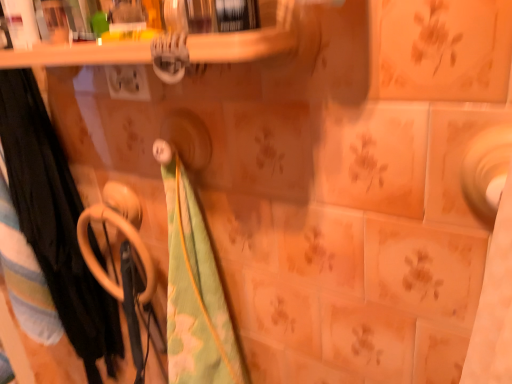
Question: Can you confirm if beige plastic towel rack at lower left is positioned to the right of matte ceramic tile at right?

Choices:
 (A) yes
 (B) no

Answer: (B)

Question: Does beige plastic towel rack at lower left have a greater width compared to matte ceramic tile at right?

Choices:
 (A) no
 (B) yes

Answer: (B)

Question: Does beige plastic towel rack at lower left have a lesser width compared to matte ceramic tile at right?

Choices:
 (A) yes
 (B) no

Answer: (B)

Question: Is beige plastic towel rack at lower left smaller than matte ceramic tile at right?

Choices:
 (A) yes
 (B) no

Answer: (B)

Question: Are beige plastic towel rack at lower left and matte ceramic tile at right beside each other?

Choices:
 (A) no
 (B) yes

Answer: (A)

Question: From a real-world perspective, is green cotton beach towel at left, which is counted as the second beach towel, starting from the left, positioned above or below beige plastic towel rack at lower left?

Choices:
 (A) below
 (B) above

Answer: (A)

Question: Is green cotton beach towel at left, which is counted as the second beach towel, starting from the left, taller or shorter than beige plastic towel rack at lower left?

Choices:
 (A) short
 (B) tall

Answer: (B)

Question: Considering the relative positions of green cotton beach towel at left, which is the 2th beach towel in right-to-left order, and beige plastic towel rack at lower left in the image provided, is green cotton beach towel at left, which is the 2th beach towel in right-to-left order, to the left or to the right of beige plastic towel rack at lower left?

Choices:
 (A) right
 (B) left

Answer: (B)

Question: Considering the positions of green cotton beach towel at left, which is counted as the second beach towel, starting from the left, and beige plastic towel rack at lower left in the image, is green cotton beach towel at left, which is counted as the second beach towel, starting from the left, wider or thinner than beige plastic towel rack at lower left?

Choices:
 (A) wide
 (B) thin

Answer: (A)

Question: Is green floral fabric at center, arranged as the third beach towel when viewed from the left, wider or thinner than black fabric towel at left, the first beach towel from the left?

Choices:
 (A) wide
 (B) thin

Answer: (B)

Question: Choose the correct answer: Is green floral fabric at center, arranged as the third beach towel when viewed from the left, inside black fabric towel at left, which is the 3th beach towel from right to left, or outside it?

Choices:
 (A) inside
 (B) outside

Answer: (B)

Question: From their relative heights in the image, would you say green floral fabric at center, which is the 1th beach towel from right to left, is taller or shorter than black fabric towel at left, the first beach towel from the left?

Choices:
 (A) tall
 (B) short

Answer: (B)

Question: Visually, is green floral fabric at center, arranged as the third beach towel when viewed from the left, positioned to the left or to the right of black fabric towel at left, the first beach towel from the left?

Choices:
 (A) right
 (B) left

Answer: (A)

Question: Is black fabric towel at left, which is the 3th beach towel from right to left, to the left or to the right of green floral fabric at center, arranged as the third beach towel when viewed from the left, in the image?

Choices:
 (A) right
 (B) left

Answer: (B)

Question: Is black fabric towel at left, which is the 3th beach towel from right to left, taller or shorter than green floral fabric at center, arranged as the third beach towel when viewed from the left?

Choices:
 (A) short
 (B) tall

Answer: (B)